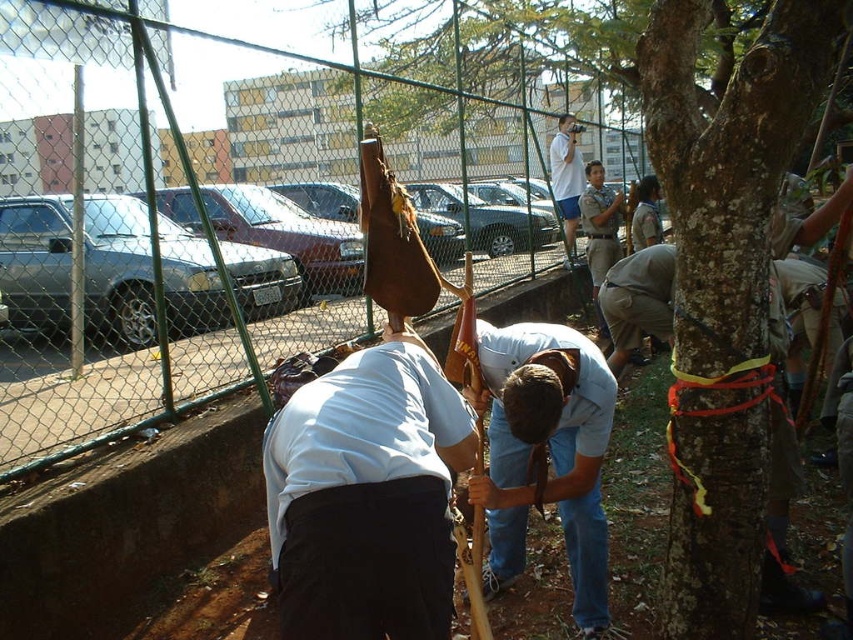
Who is higher up, green chain-link fence at center or smooth bark tree at center?

Positioned higher is green chain-link fence at center.

In the scene shown: Does green chain-link fence at center have a lesser height compared to smooth bark tree at center?

Indeed, green chain-link fence at center has a lesser height compared to smooth bark tree at center.

Does point (51, 180) lie behind point (740, 609)?

Yes, it is.

Identify the location of green chain-link fence at center. (241, 214).

Does green chain-link fence at center come in front of light blue denim jeans at center?

No.

Who is more forward, (169, 202) or (509, 541)?

Positioned in front is point (509, 541).

Locate an element on the screen. Image resolution: width=853 pixels, height=640 pixels. green chain-link fence at center is located at coordinates (241, 214).

I want to click on light blue denim jeans at center, so click(x=546, y=454).

Is light blue denim jeans at center positioned before white matte shirt at upper center?

Yes, light blue denim jeans at center is in front of white matte shirt at upper center.

Is point (563, 336) closer to camera compared to point (569, 232)?

That is True.

In order to click on light blue denim jeans at center in this screenshot , I will do `click(546, 454)`.